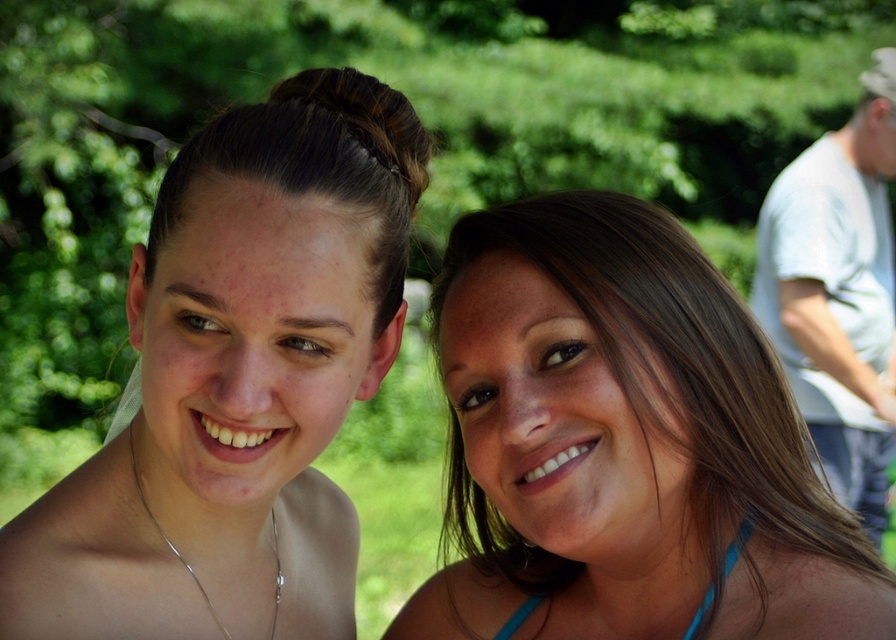
Question: Is matte skin at center below blue fabric bikini top at lower right?

Choices:
 (A) yes
 (B) no

Answer: (B)

Question: Which is nearer to the white cotton shirt at upper right?

Choices:
 (A) brown hair at center
 (B) blue fabric bikini top at lower right
 (C) matte brown hair bun at upper center
 (D) matte skin at center

Answer: (A)

Question: Considering the real-world distances, which object is closest to the matte skin at center?

Choices:
 (A) matte brown hair bun at upper center
 (B) brown hair at center

Answer: (A)

Question: Based on their relative distances, which object is farther from the blue fabric bikini top at lower right?

Choices:
 (A) white cotton shirt at upper right
 (B) matte skin at center

Answer: (A)

Question: Does matte skin at center lie behind white cotton shirt at upper right?

Choices:
 (A) yes
 (B) no

Answer: (B)

Question: Is brown hair at center to the right of white cotton shirt at upper right from the viewer's perspective?

Choices:
 (A) no
 (B) yes

Answer: (A)